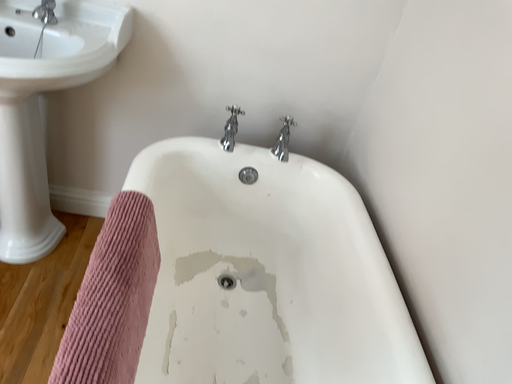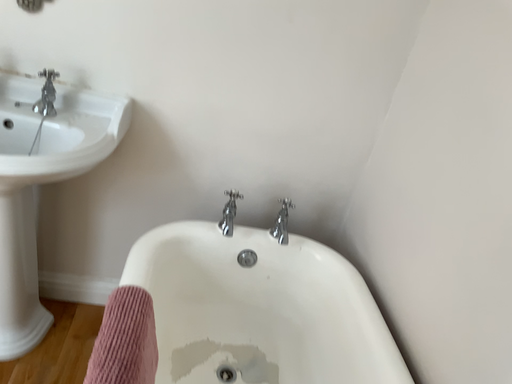
Question: Which way did the camera rotate in the video?

Choices:
 (A) rotated upward
 (B) rotated downward

Answer: (A)